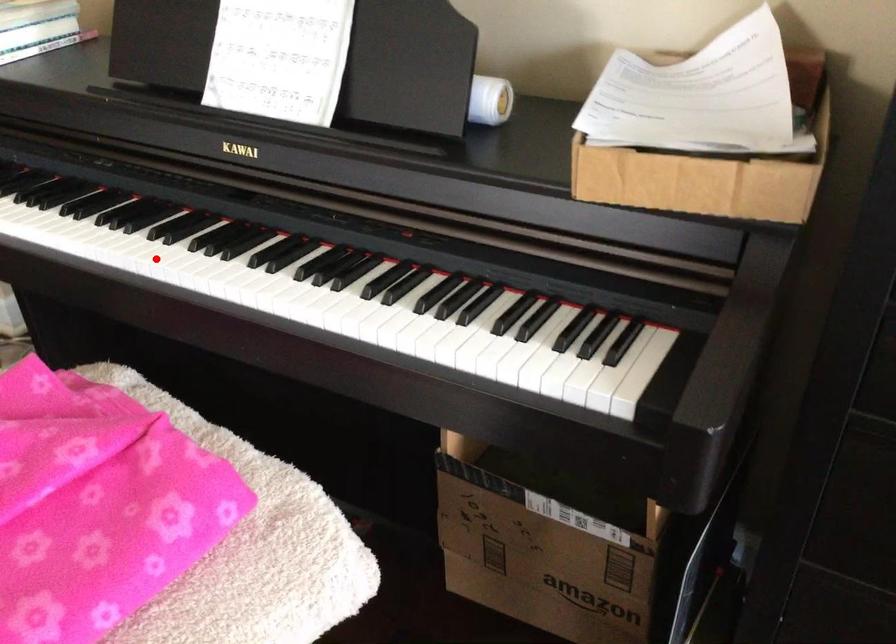
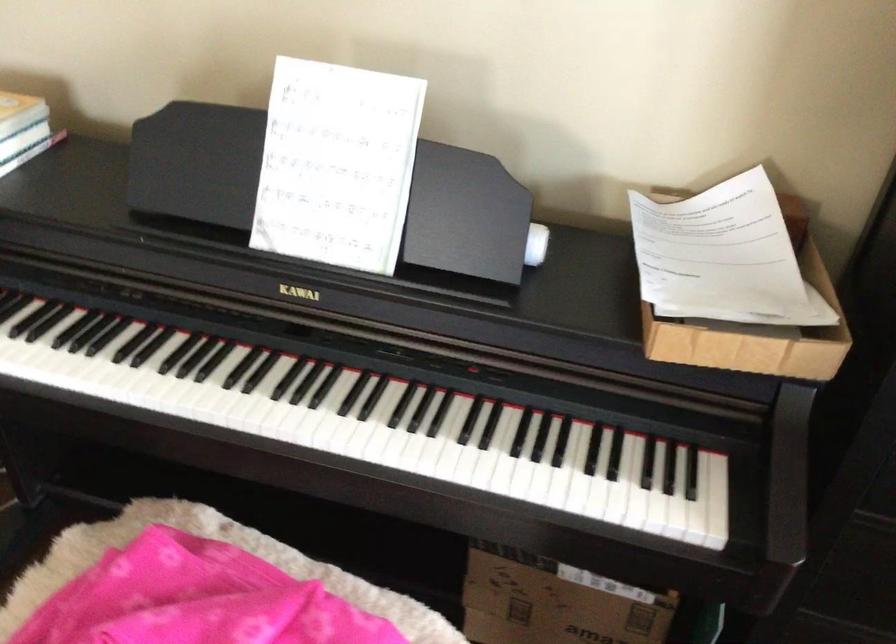
Locate, in the second image, the point that corresponds to the highlighted location in the first image.

(245, 412)